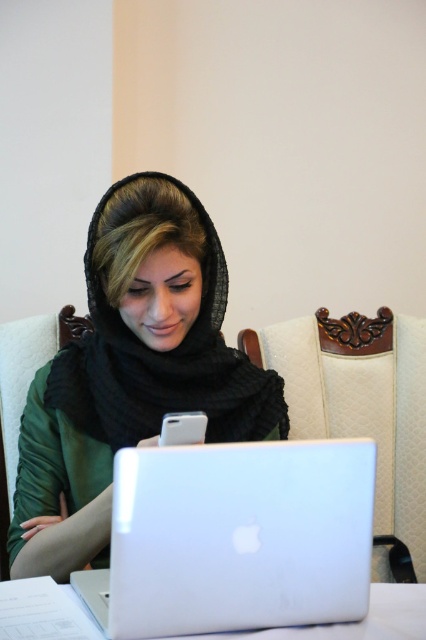
Question: Does silver metallic laptop at center lie behind white matte smartphone at center?

Choices:
 (A) no
 (B) yes

Answer: (A)

Question: Which object appears farthest from the camera in this image?

Choices:
 (A) white matte smartphone at center
 (B) silver metallic laptop at center
 (C) white glossy table at lower center
 (D) matte black hijab at center

Answer: (D)

Question: In this image, where is matte black hijab at center located relative to white glossy table at lower center?

Choices:
 (A) right
 (B) left

Answer: (B)

Question: Which object is closer to the camera taking this photo?

Choices:
 (A) silver metallic laptop at center
 (B) matte black hijab at center

Answer: (A)

Question: Estimate the real-world distances between objects in this image. Which object is closer to the matte black hijab at center?

Choices:
 (A) silver metallic laptop at center
 (B) white matte smartphone at center

Answer: (A)

Question: Is silver metallic laptop at center positioned in front of white matte smartphone at center?

Choices:
 (A) yes
 (B) no

Answer: (A)